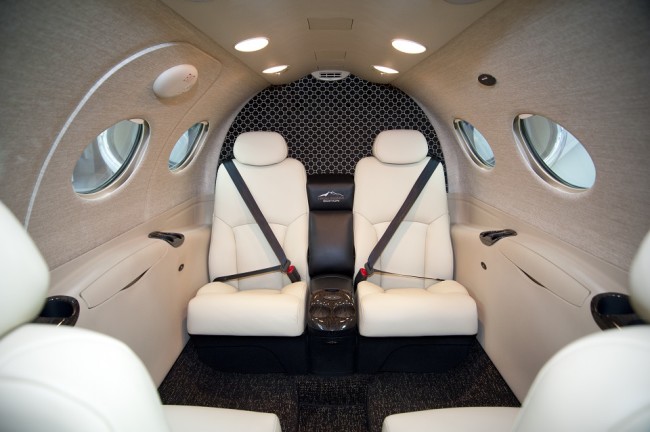
What are the coordinates of `windows` in the screenshot? It's located at (563, 155), (482, 148), (187, 147), (93, 170).